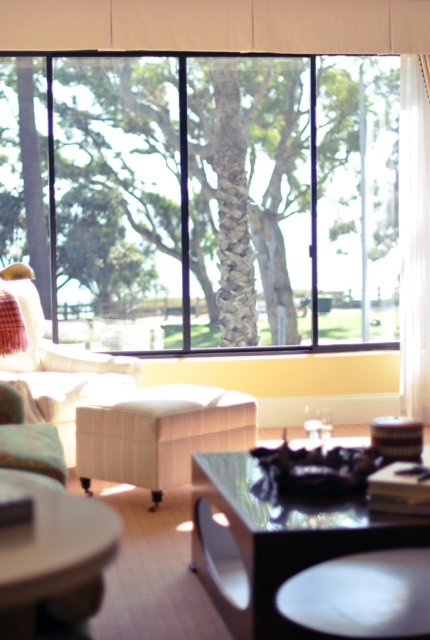
Question: Among these points, which one is farthest from the camera?

Choices:
 (A) (46, 413)
 (B) (39, 618)

Answer: (A)

Question: Estimate the real-world distances between objects in this image. Which object is farther from the clear glass window at center?

Choices:
 (A) wooden round table at lower left
 (B) white sheer curtain at right

Answer: (A)

Question: Which object is the farthest from the transparent glass coffee table at center?

Choices:
 (A) white sheer curtain at right
 (B) wooden round table at lower left
 (C) white fabric curtain at upper center

Answer: (C)

Question: Is transparent glass coffee table at center above white sheer curtain at right?

Choices:
 (A) yes
 (B) no

Answer: (B)

Question: From the image, what is the correct spatial relationship of clear glass window at center in relation to plaid fabric armchair at left?

Choices:
 (A) right
 (B) left

Answer: (A)

Question: Can you confirm if white fabric curtain at upper center is positioned below plaid fabric armchair at left?

Choices:
 (A) no
 (B) yes

Answer: (A)